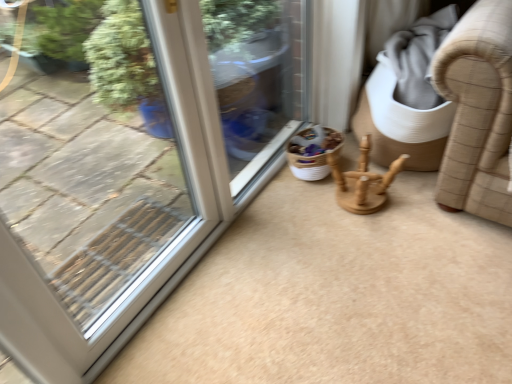
At what (x,y) coordinates should I click in order to perform the action: click on free space in front of beige woven armchair at right. Please return your answer as a coordinate pair (x, y). Looking at the image, I should click on (418, 236).